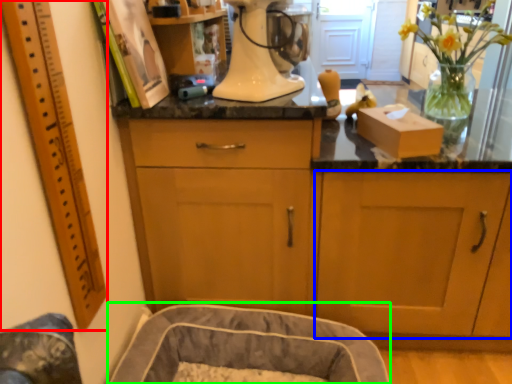
Question: Estimate the real-world distances between objects in this image. Which object is farther from ruler (highlighted by a red box), cabinetry (highlighted by a blue box) or dog bed (highlighted by a green box)?

Choices:
 (A) cabinetry
 (B) dog bed

Answer: (A)